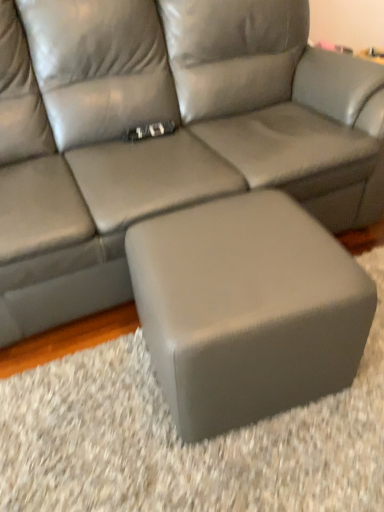
Locate an element on the screen. The height and width of the screenshot is (512, 384). free location above matte gray ottoman at center (from a real-world perspective) is located at coordinates coord(236,261).